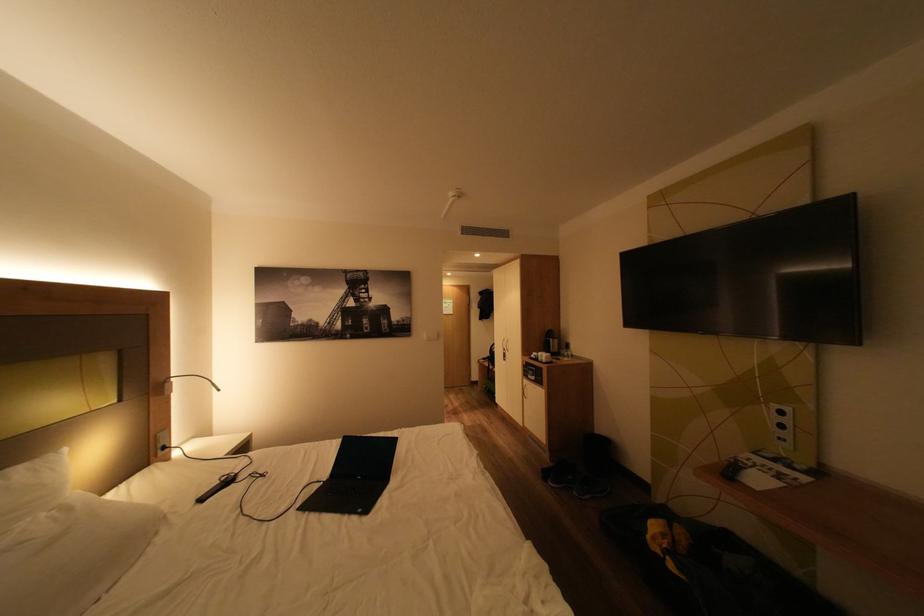
This screenshot has width=924, height=616. In order to click on silver cabinet handle in this screenshot , I will do `click(504, 349)`.